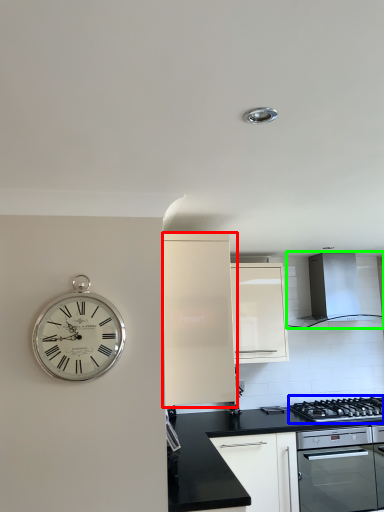
Question: Estimate the real-world distances between objects in this image. Which object is closer to cabinetry (highlighted by a red box), gas stove (highlighted by a blue box) or home appliance (highlighted by a green box)?

Choices:
 (A) gas stove
 (B) home appliance

Answer: (A)